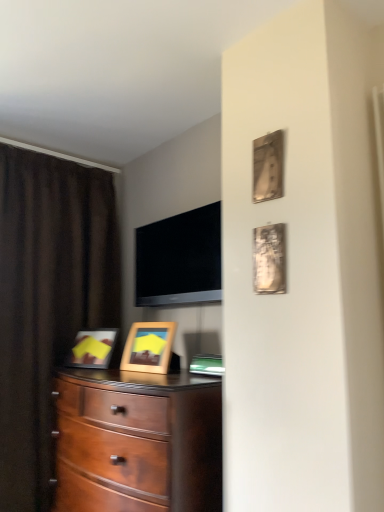
This screenshot has width=384, height=512. Find the location of `mahogany wood dresser at center`. mahogany wood dresser at center is located at coordinates (139, 442).

Find the location of a particular element. The image size is (384, 512). brown fabric curtain at left is located at coordinates (47, 302).

How much space does metallic silver picture frame at upper right, the first picture frame when ordered from front to back, occupy vertically?

metallic silver picture frame at upper right, the first picture frame when ordered from front to back, is 10.75 inches in height.

What do you see at coordinates (148, 347) in the screenshot? I see `wooden picture frame at center, which appears as the first picture frame when viewed from the back` at bounding box center [148, 347].

The width and height of the screenshot is (384, 512). Identify the location of mahogany wood dresser at center. (139, 442).

Can you see metallic silver picture frame at upper right, the first picture frame when ordered from right to left, touching mahogany wood dresser at center?

metallic silver picture frame at upper right, the first picture frame when ordered from right to left, and mahogany wood dresser at center are not in contact.

Locate an element on the screen. This screenshot has height=512, width=384. chest of drawers on the left of the metallic silver picture frame at upper right, marked as the 2th picture frame in a bottom-to-top arrangement is located at coordinates (139, 442).

Considering the relative sizes of metallic silver picture frame at upper right, the first picture frame when ordered from right to left, and mahogany wood dresser at center in the image provided, is metallic silver picture frame at upper right, the first picture frame when ordered from right to left, shorter than mahogany wood dresser at center?

Correct, metallic silver picture frame at upper right, the first picture frame when ordered from right to left, is not as tall as mahogany wood dresser at center.

Considering the positions of points (285, 257) and (173, 506), is point (285, 257) closer to camera compared to point (173, 506)?

Yes, it is in front of point (173, 506).

Can you confirm if mahogany wood dresser at center is thinner than wooden picture frame at center, the first picture frame ordered from the bottom?

In fact, mahogany wood dresser at center might be wider than wooden picture frame at center, the first picture frame ordered from the bottom.

From the picture: In the image, is mahogany wood dresser at center on the left side or the right side of wooden picture frame at center, which appears as the first picture frame when viewed from the back?

Based on their positions, mahogany wood dresser at center is located to the left of wooden picture frame at center, which appears as the first picture frame when viewed from the back.

Where is `the 3rd picture frame behind the mahogany wood dresser at center`? the 3rd picture frame behind the mahogany wood dresser at center is located at coordinates (148, 347).

Does mahogany wood dresser at center have a larger size compared to wooden picture frame at center, the first picture frame ordered from the bottom?

Yes, mahogany wood dresser at center is bigger than wooden picture frame at center, the first picture frame ordered from the bottom.

Looking at this image, is brown fabric curtain at left at the back of metallic silver picture frame at upper right, marked as the 2th picture frame in a bottom-to-top arrangement?

No, metallic silver picture frame at upper right, marked as the 2th picture frame in a bottom-to-top arrangement, is not facing the opposite direction of brown fabric curtain at left.

Which is more to the left, metallic silver picture frame at upper right, which appears as the 3th picture frame when viewed from the left, or brown fabric curtain at left?

brown fabric curtain at left.

From the picture: From the image's perspective, is metallic silver picture frame at upper right, the first picture frame when ordered from front to back, above brown fabric curtain at left?

Yes, from the image's perspective, metallic silver picture frame at upper right, the first picture frame when ordered from front to back, is over brown fabric curtain at left.

I want to click on picture frame that is the 1st object located above the wooden picture frame at center, the 3th picture frame viewed from the top (from the image's perspective), so click(269, 259).

Considering the relative sizes of metallic silver picture frame at upper right, which is counted as the third picture frame, starting from the back, and wooden picture frame at center, the first picture frame ordered from the bottom, in the image provided, is metallic silver picture frame at upper right, which is counted as the third picture frame, starting from the back, thinner than wooden picture frame at center, the first picture frame ordered from the bottom,?

Yes, metallic silver picture frame at upper right, which is counted as the third picture frame, starting from the back, is thinner than wooden picture frame at center, the first picture frame ordered from the bottom.

From a real-world perspective, is metallic silver picture frame at upper right, the first picture frame when ordered from right to left, located higher than wooden picture frame at center, which is the first picture frame from left to right?

Yes, from a real-world perspective, metallic silver picture frame at upper right, the first picture frame when ordered from right to left, is over wooden picture frame at center, which is the first picture frame from left to right

Are metallic silver picture frame at upper right, which is counted as the third picture frame, starting from the back, and wooden picture frame at center, arranged as the 3th picture frame when viewed from the right, located far from each other?

Actually, metallic silver picture frame at upper right, which is counted as the third picture frame, starting from the back, and wooden picture frame at center, arranged as the 3th picture frame when viewed from the right, are a little close together.

Is metallic silver picture frame at upper right, acting as the second picture frame starting from the back, oriented towards brown fabric curtain at left?

No, metallic silver picture frame at upper right, acting as the second picture frame starting from the back, is not oriented towards brown fabric curtain at left.

Which object is further away from the camera, metallic silver picture frame at upper right, which is counted as the third picture frame, starting from the bottom, or brown fabric curtain at left?

brown fabric curtain at left is behind.

Measure the distance between metallic silver picture frame at upper right, the first picture frame in the top-to-bottom sequence, and brown fabric curtain at left.

metallic silver picture frame at upper right, the first picture frame in the top-to-bottom sequence, and brown fabric curtain at left are 1.61 meters apart from each other.

At what (x,y) coordinates should I click in order to perform the action: click on curtain on the left of metallic silver picture frame at upper right, which is counted as the third picture frame, starting from the bottom. Please return your answer as a coordinate pair (x, y). Looking at the image, I should click on (47, 302).

Consider the image. From the image's perspective, between brown fabric curtain at left and metallic silver picture frame at upper right, which is counted as the third picture frame, starting from the bottom, which one is located above?

metallic silver picture frame at upper right, which is counted as the third picture frame, starting from the bottom, from the image's perspective.

Is brown fabric curtain at left oriented towards metallic silver picture frame at upper right, which is counted as the third picture frame, starting from the bottom?

Yes, brown fabric curtain at left is turned towards metallic silver picture frame at upper right, which is counted as the third picture frame, starting from the bottom.

In the scene shown: Which is in front, brown fabric curtain at left or metallic silver picture frame at upper right, which is counted as the third picture frame, starting from the bottom?

metallic silver picture frame at upper right, which is counted as the third picture frame, starting from the bottom.

I want to click on curtain below the flat screen tv at upper center (from a real-world perspective), so click(x=47, y=302).

Considering the relative sizes of flat screen tv at upper center and brown fabric curtain at left in the image provided, is flat screen tv at upper center taller than brown fabric curtain at left?

Incorrect, the height of flat screen tv at upper center is not larger of that of brown fabric curtain at left.

Is flat screen tv at upper center in front of or behind brown fabric curtain at left in the image?

Clearly, flat screen tv at upper center is behind brown fabric curtain at left.

How many degrees apart are the facing directions of flat screen tv at upper center and brown fabric curtain at left?

There is a 89.7-degree angle between the facing directions of flat screen tv at upper center and brown fabric curtain at left.

The image size is (384, 512). I want to click on chest of drawers located on the left of metallic silver picture frame at upper right, which appears as the 3th picture frame when viewed from the left, so click(139, 442).

Identify the location of picture frame that is the 1st object above the mahogany wood dresser at center (from a real-world perspective). (148, 347).

Considering their positions, is wooden picture frame at center, which appears as the first picture frame when viewed from the back, positioned further to brown fabric curtain at left than metallic silver picture frame at upper right, which is counted as the third picture frame, starting from the back?

Among the two, metallic silver picture frame at upper right, which is counted as the third picture frame, starting from the back, is located further to brown fabric curtain at left.

Estimate the real-world distances between objects in this image. Which object is further from flat screen tv at upper center, mahogany wood dresser at center or brown fabric curtain at left?

Based on the image, mahogany wood dresser at center appears to be further to flat screen tv at upper center.

Based on their spatial positions, is mahogany wood dresser at center or metallic silver picture frame at upper right, marked as the 2th picture frame in a bottom-to-top arrangement, closer to flat screen tv at upper center?

Based on the image, mahogany wood dresser at center appears to be nearer to flat screen tv at upper center.

Which object lies further to the anchor point metallic silver picture frame at upper right, which is the 2th picture frame in left-to-right order, metallic silver picture frame at upper right, which is counted as the third picture frame, starting from the back, or brown fabric curtain at left?

brown fabric curtain at left.

Consider the image. Which object lies nearer to the anchor point wooden picture frame at center, the 3th picture frame viewed from the top, mahogany wood dresser at center or flat screen tv at upper center?

Based on the image, mahogany wood dresser at center appears to be nearer to wooden picture frame at center, the 3th picture frame viewed from the top.

Based on their spatial positions, is metallic silver picture frame at upper right, positioned as the second picture frame in top-to-bottom order, or wooden picture frame at center, acting as the third picture frame starting from the front, closer to flat screen tv at upper center?

wooden picture frame at center, acting as the third picture frame starting from the front, is closer to flat screen tv at upper center.

Which object lies nearer to the anchor point brown fabric curtain at left, metallic silver picture frame at upper right, which appears as the 3th picture frame when viewed from the left, or wooden picture frame at center, arranged as the 3th picture frame when viewed from the right?

wooden picture frame at center, arranged as the 3th picture frame when viewed from the right.

When comparing their distances from brown fabric curtain at left, does wooden picture frame at center, acting as the third picture frame starting from the front, or flat screen tv at upper center seem closer?

flat screen tv at upper center lies closer to brown fabric curtain at left than the other object.

Find the location of a particular element. This screenshot has height=512, width=384. picture frame that lies between metallic silver picture frame at upper right, which is the second picture frame in front-to-back order, and wooden picture frame at center, arranged as the 3th picture frame when viewed from the right, from top to bottom is located at coordinates (269, 259).

Locate an element on the screen. Image resolution: width=384 pixels, height=512 pixels. curtain located between mahogany wood dresser at center and wooden picture frame at center, which appears as the first picture frame when viewed from the back, in the depth direction is located at coordinates (47, 302).

Locate an element on the screen. The width and height of the screenshot is (384, 512). picture frame between metallic silver picture frame at upper right, which appears as the 3th picture frame when viewed from the left, and mahogany wood dresser at center from top to bottom is located at coordinates (148, 347).

I want to click on curtain that lies between flat screen tv at upper center and mahogany wood dresser at center from top to bottom, so click(x=47, y=302).